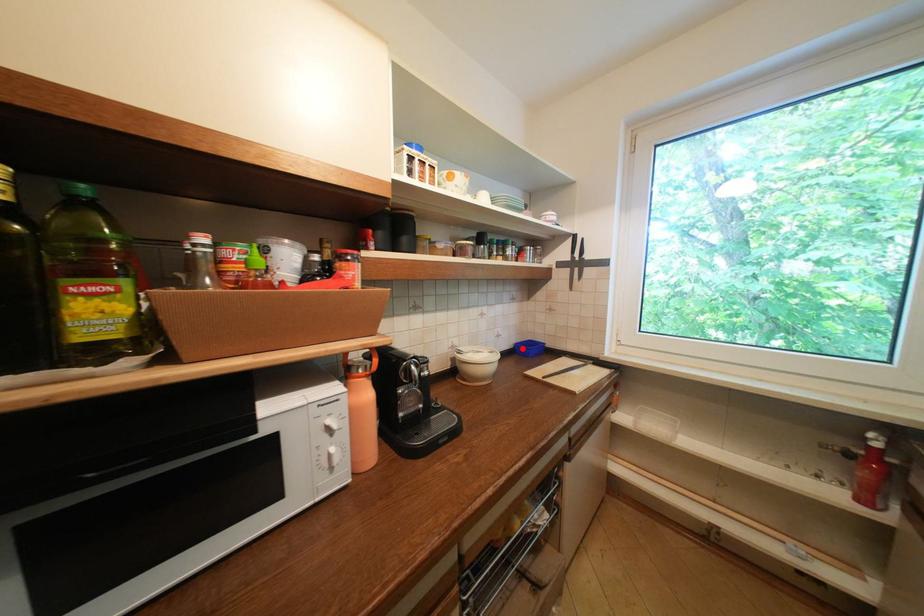
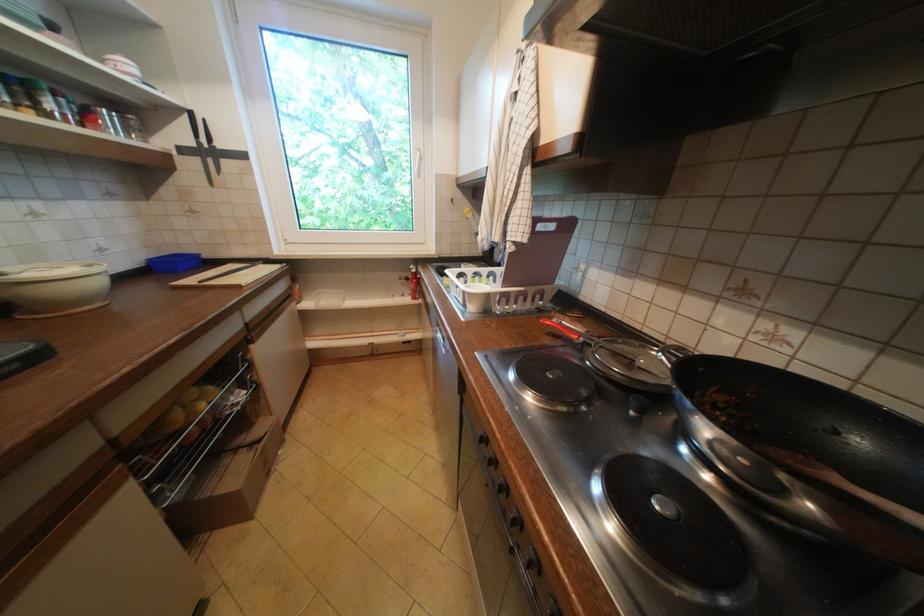
Find the pixel in the second image that matches the highlighted location in the first image.

(156, 267)